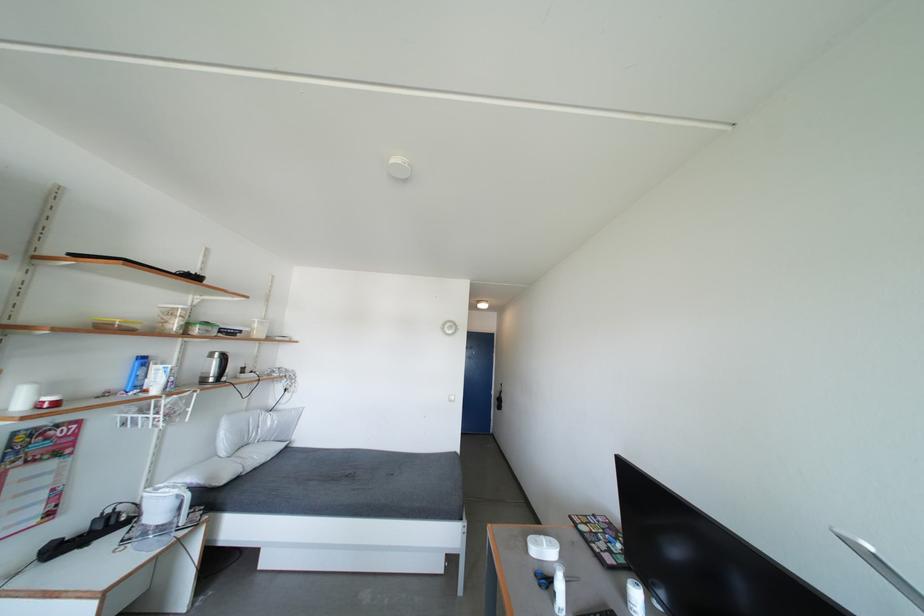
Where is `white pitcher handle`? The image size is (924, 616). white pitcher handle is located at coordinates (881, 567).